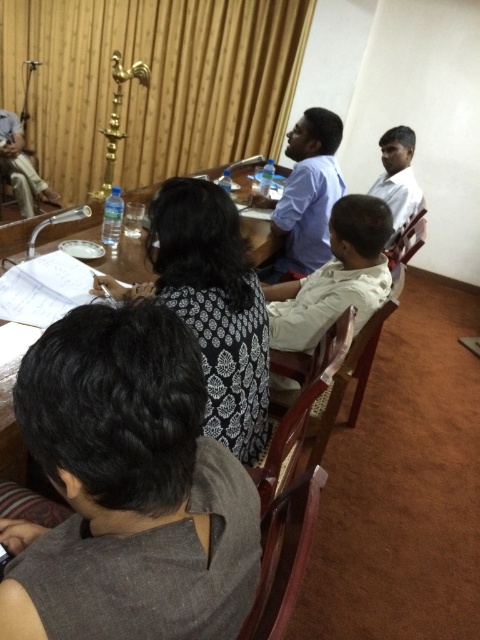
Question: Does blue shirt at center appear under matte black laptop at left?

Choices:
 (A) no
 (B) yes

Answer: (B)

Question: Which point appears farthest from the camera in this image?

Choices:
 (A) (392, 173)
 (B) (105, 486)
 (C) (312, 196)
 (D) (9, 177)

Answer: (D)

Question: Considering the relative positions of dark gray shirt at lower left and wooden table at center in the image provided, where is dark gray shirt at lower left located with respect to wooden table at center?

Choices:
 (A) right
 (B) left

Answer: (A)

Question: Which object is farther from the camera taking this photo?

Choices:
 (A) white cotton shirt at center
 (B) white matte shirt at upper right

Answer: (B)

Question: Does wooden table at center appear over blue shirt at center?

Choices:
 (A) no
 (B) yes

Answer: (A)

Question: Which of the following is the closest to the observer?

Choices:
 (A) (398, 128)
 (B) (252, 532)
 (C) (232, 381)
 (D) (2, 141)

Answer: (B)